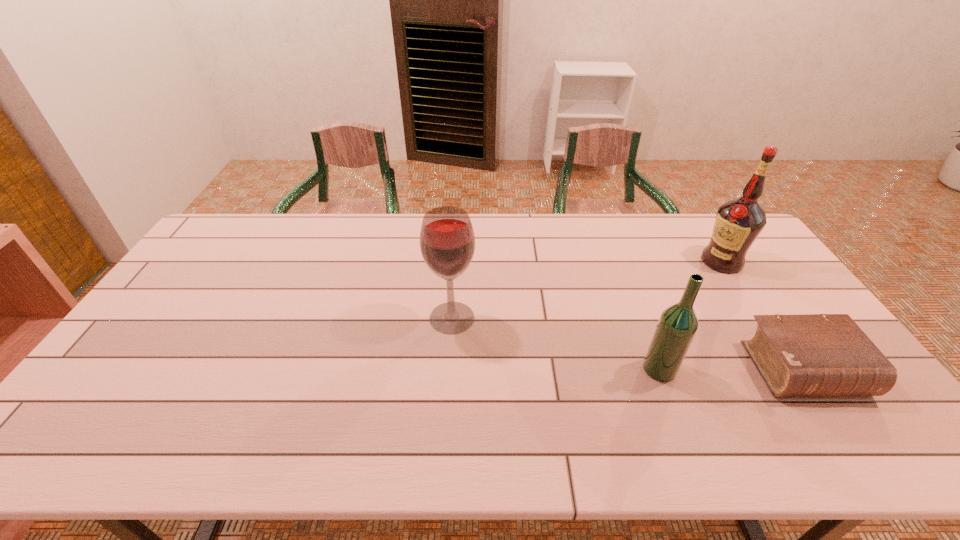
Choose which alcohol is the nearest neighbor to the Bible. Please provide its 2D coordinates. Your answer should be formatted as a tuple, i.e. [(x, y)], where the tuple contains the x and y coordinates of a point satisfying the conditions above.

[(676, 328)]

Where is `vacant space that satisfies the following two spatial constraints: 1. on the label of the tallest alcohol; 2. on the front side of the third object from right to left`? vacant space that satisfies the following two spatial constraints: 1. on the label of the tallest alcohol; 2. on the front side of the third object from right to left is located at coordinates (792, 369).